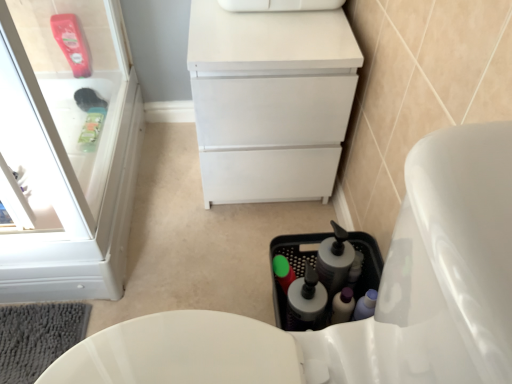
You are a GUI agent. You are given a task and a screenshot of the screen. Output one action in this format:
    pyautogui.click(x=<x>, y=<y>)
    Task: Click on the free space above white matte cabinet at center (from a real-world perspective)
    Image resolution: width=512 pixels, height=384 pixels.
    Given the screenshot: What is the action you would take?
    pyautogui.click(x=257, y=16)